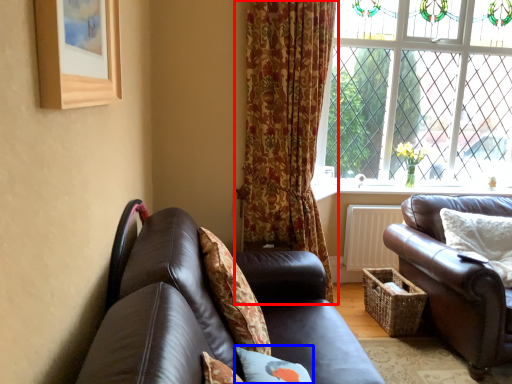
Question: Which point is further to the camera, curtain (highlighted by a red box) or pillow (highlighted by a blue box)?

Choices:
 (A) curtain
 (B) pillow

Answer: (A)